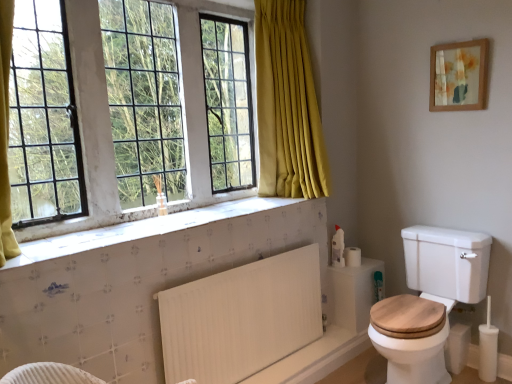
Question: In terms of width, does white glass window at upper left look wider or thinner when compared to white textured tile at lower center?

Choices:
 (A) wide
 (B) thin

Answer: (B)

Question: From the image's perspective, is white glass window at upper left located above or below white textured tile at lower center?

Choices:
 (A) above
 (B) below

Answer: (A)

Question: Estimate the real-world distances between objects in this image. Which object is closer to the white textured tile at lower center?

Choices:
 (A) white wood toilet at lower right
 (B) white matte toilet paper at right
 (C) wooden framed artwork at upper right
 (D) white glass window at upper left
 (E) white ribbed radiator at lower center

Answer: (D)

Question: Based on their relative distances, which object is farther from the white textured tile at lower center?

Choices:
 (A) wooden framed artwork at upper right
 (B) white glass window at upper left
 (C) white wood toilet at lower right
 (D) white matte toilet paper at right
 (E) white ribbed radiator at lower center

Answer: (A)